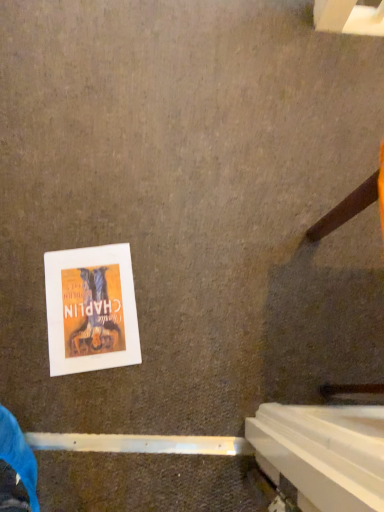
Image resolution: width=384 pixels, height=512 pixels. What do you see at coordinates (91, 309) in the screenshot?
I see `matte paper poster at lower left` at bounding box center [91, 309].

Where is `matte paper poster at lower left`? The width and height of the screenshot is (384, 512). matte paper poster at lower left is located at coordinates [x=91, y=309].

You are a GUI agent. You are given a task and a screenshot of the screen. Output one action in this format:
    pyautogui.click(x=<x>, y=<y>)
    Task: Click on the matte paper poster at lower left
    This screenshot has width=384, height=512.
    Given the screenshot: What is the action you would take?
    pyautogui.click(x=91, y=309)